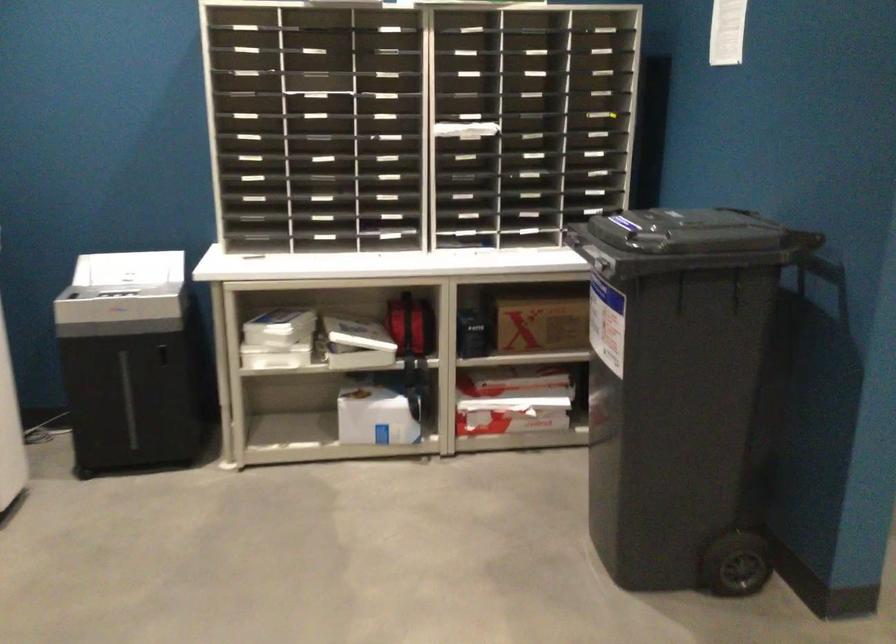
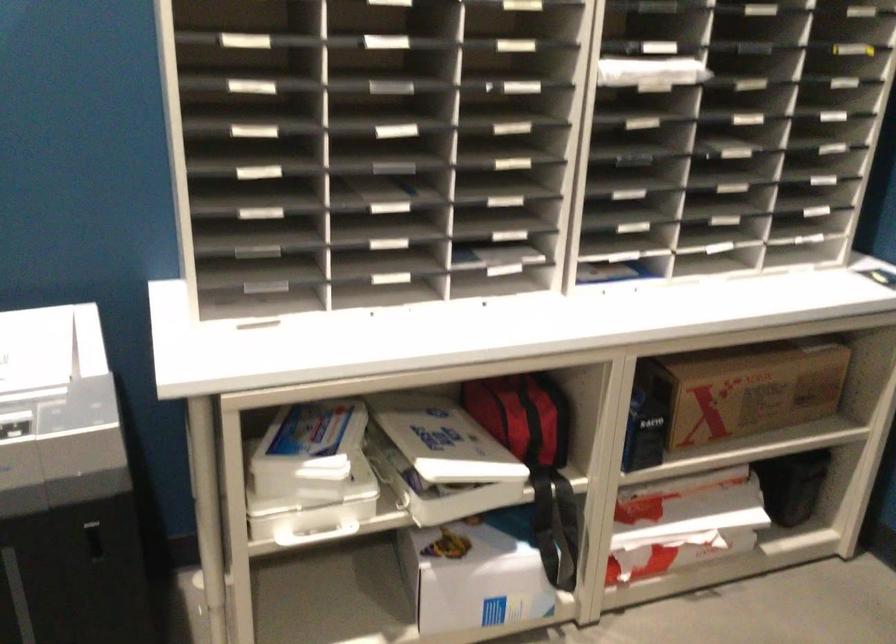
What movement of the cameraman would produce the second image?

The cameraman walked toward left, forward.